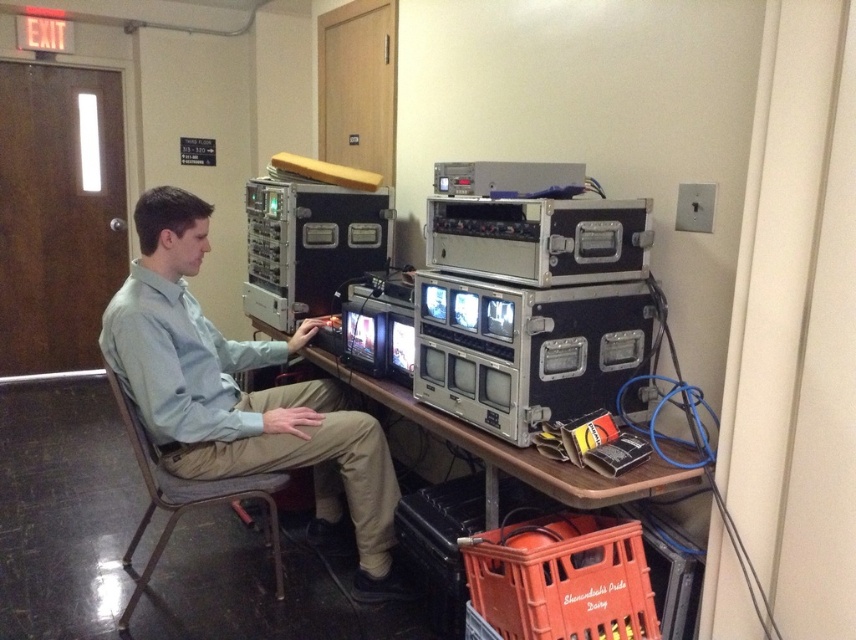
Question: Which point is farther to the camera?

Choices:
 (A) wooden table at center
 (B) light blue shirt at center

Answer: (B)

Question: Which of the following is the farthest from the observer?

Choices:
 (A) light blue shirt at center
 (B) wooden table at center

Answer: (A)

Question: Which point appears farthest from the camera in this image?

Choices:
 (A) (528, 524)
 (B) (265, 497)
 (C) (649, 490)

Answer: (B)

Question: Is light blue shirt at center closer to camera compared to gray fabric chair at center?

Choices:
 (A) no
 (B) yes

Answer: (B)

Question: Is light blue shirt at center further to the viewer compared to wooden table at center?

Choices:
 (A) yes
 (B) no

Answer: (A)

Question: Is wooden table at center below gray fabric chair at center?

Choices:
 (A) yes
 (B) no

Answer: (B)